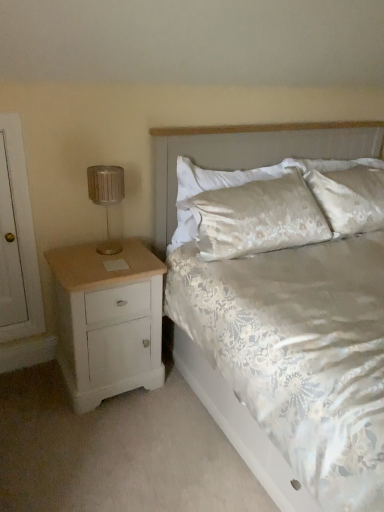
Question: Would you say white floral fabric bed at center is to the left or to the right of satin fabric headboard at upper center in the picture?

Choices:
 (A) left
 (B) right

Answer: (B)

Question: Is white floral fabric bed at center situated inside satin fabric headboard at upper center or outside?

Choices:
 (A) outside
 (B) inside

Answer: (A)

Question: Which is farther from the metallic silver lamp at left?

Choices:
 (A) satin fabric headboard at upper center
 (B) silky white pillow at upper center
 (C) white floral fabric bed at center
 (D) white painted wood nightstand at left

Answer: (A)

Question: Considering the real-world distances, which object is closest to the white floral fabric bed at center?

Choices:
 (A) metallic silver lamp at left
 (B) silky white pillow at upper center
 (C) satin fabric headboard at upper center
 (D) white painted wood nightstand at left

Answer: (C)